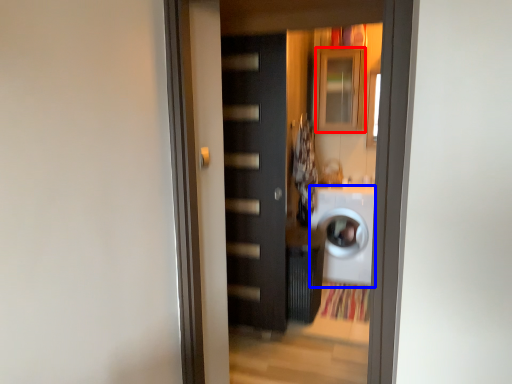
Question: Among these objects, which one is nearest to the camera, cabinetry (highlighted by a red box) or washing machine (highlighted by a blue box)?

Choices:
 (A) cabinetry
 (B) washing machine

Answer: (B)